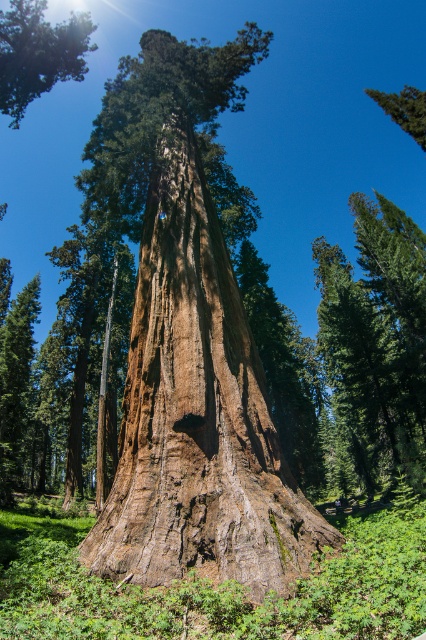
What do you see at coordinates (196, 412) in the screenshot?
I see `brown rough bark tree trunk at center` at bounding box center [196, 412].

Which is in front, point (199, 467) or point (25, 12)?

Point (199, 467)

The width and height of the screenshot is (426, 640). Describe the element at coordinates (196, 412) in the screenshot. I see `brown rough bark tree trunk at center` at that location.

Locate an element on the screen. brown rough bark tree trunk at center is located at coordinates (196, 412).

Can you confirm if brown rough bark tree trunk at center is thinner than green rough bark tree at upper right?

Yes, brown rough bark tree trunk at center is thinner than green rough bark tree at upper right.

Between brown rough bark tree trunk at center and green rough bark tree at upper right, which one appears on the left side from the viewer's perspective?

brown rough bark tree trunk at center

Which is behind, point (252, 396) or point (393, 104)?

The point (393, 104) is more distant.

The width and height of the screenshot is (426, 640). Find the location of `brown rough bark tree trunk at center`. brown rough bark tree trunk at center is located at coordinates (196, 412).

Is smooth brown tree trunk at upper left positioned before green rough bark tree at upper right?

Yes.

Where is `smooth brown tree trunk at upper left`? The width and height of the screenshot is (426, 640). smooth brown tree trunk at upper left is located at coordinates (37, 52).